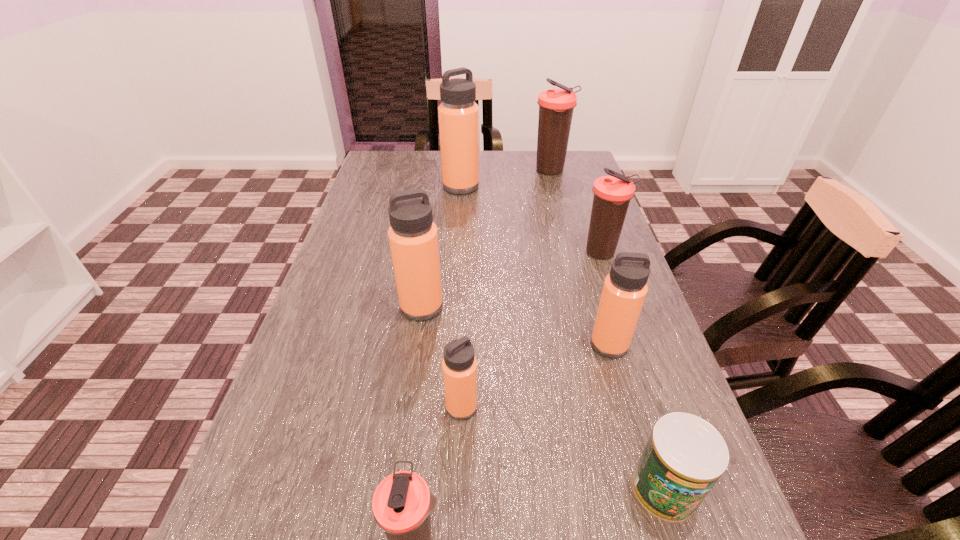
This screenshot has height=540, width=960. Find the location of `the nearest orange thermos bottle`. the nearest orange thermos bottle is located at coordinates (459, 366).

This screenshot has width=960, height=540. What are the coordinates of `the shortest object` in the screenshot? It's located at (684, 457).

The height and width of the screenshot is (540, 960). I want to click on vacant space located on the left of the tallest thermos bottle, so pyautogui.click(x=421, y=186).

Image resolution: width=960 pixels, height=540 pixels. Identify the location of blank area located on the left of the farthest brown thermos bottle. (503, 171).

Where is `vacant space situated 0.220m on the back of the fourth farthest object`? The image size is (960, 540). vacant space situated 0.220m on the back of the fourth farthest object is located at coordinates (431, 238).

Locate an element on the screen. vacant position located 0.260m on the back of the second nearest brown thermos bottle is located at coordinates (581, 192).

The image size is (960, 540). Find the location of `free region located 0.120m on the left of the second nearest orange thermos bottle`. free region located 0.120m on the left of the second nearest orange thermos bottle is located at coordinates (534, 345).

The image size is (960, 540). I want to click on free location located 0.050m on the back of the sixth farthest object, so click(x=463, y=372).

Identify the location of vacant region located 0.140m on the back of the can. The width and height of the screenshot is (960, 540). (634, 388).

Find the location of `can that is at the right edge`. can that is at the right edge is located at coordinates (684, 457).